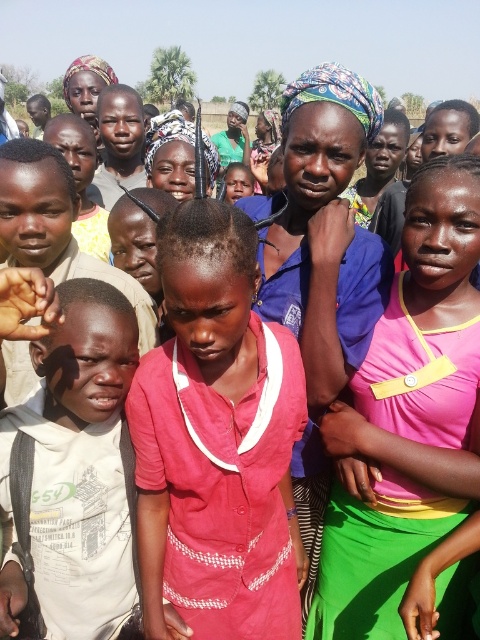
Is pink fabric dress at center positioned in front of blue woven fabric headscarf at center?

No, pink fabric dress at center is behind blue woven fabric headscarf at center.

Can you confirm if pink fabric dress at center is smaller than blue woven fabric headscarf at center?

Yes.

Who is more distant from viewer, (346, 410) or (332, 193)?

The point (332, 193) is more distant.

Image resolution: width=480 pixels, height=640 pixels. In order to click on pink fabric dress at center in this screenshot , I will do `click(408, 417)`.

Is pink fabric dress at center to the right of white cotton shirt at left from the viewer's perspective?

Correct, you'll find pink fabric dress at center to the right of white cotton shirt at left.

How distant is pink fabric dress at center from white cotton shirt at left?

pink fabric dress at center and white cotton shirt at left are 1.10 meters apart.

Is point (373, 593) positioned behind point (57, 481)?

Yes.

Where is `pink fabric dress at center`? The image size is (480, 640). pink fabric dress at center is located at coordinates (408, 417).

Can you confirm if blue woven fabric headscarf at center is bigger than white cotton shirt at left?

Indeed, blue woven fabric headscarf at center has a larger size compared to white cotton shirt at left.

Who is more forward, (x=328, y=300) or (x=72, y=563)?

Point (x=72, y=563) is in front.

Is point (294, 214) farther from camera compared to point (68, 349)?

Yes, it is behind point (68, 349).

Identify the location of blue woven fabric headscarf at center. (323, 266).